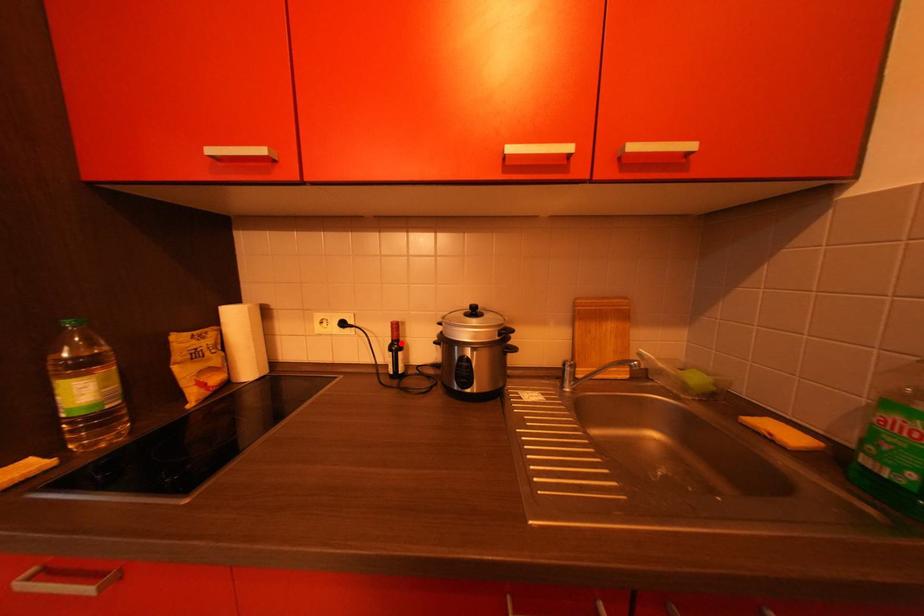
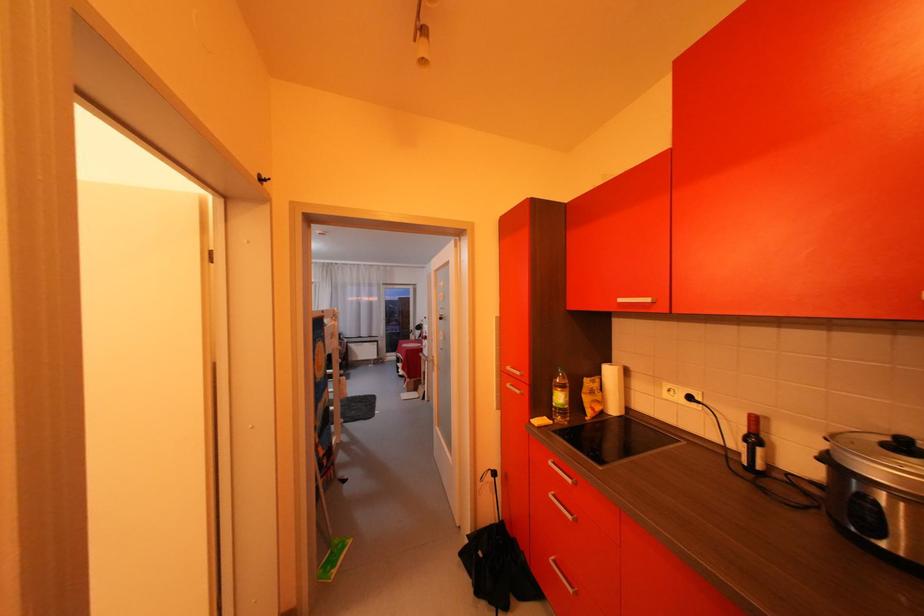
Find the pixel in the second image that matches the highlighted location in the first image.

(757, 434)